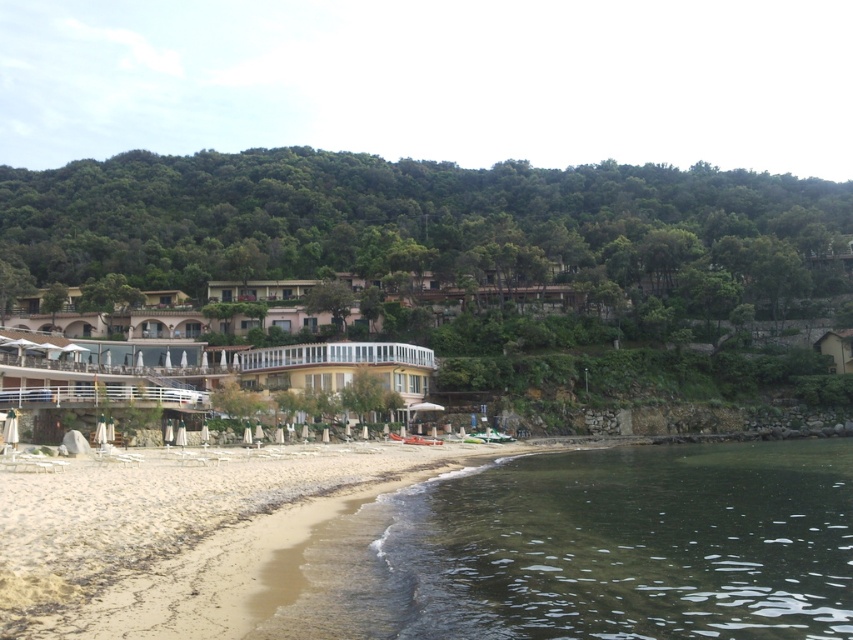
You are a photographer planning to capture a landscape photo of the green leafy hillside at upper center and the white glass hotel at center. Which object will occupy more space in your photo frame?

The green leafy hillside at upper center will occupy more space in the photo frame because it is larger in size than the white glass hotel at center according to the description.

Looking at this image, you are standing at the beach and see two points marked on the sand. The first point is at coordinate point [808,531] and the second is at point [76,512]. Which point is closer to your current position?

Point [76,512] is closer to your current position because it is closer to the camera than point [808,531], which is further away.